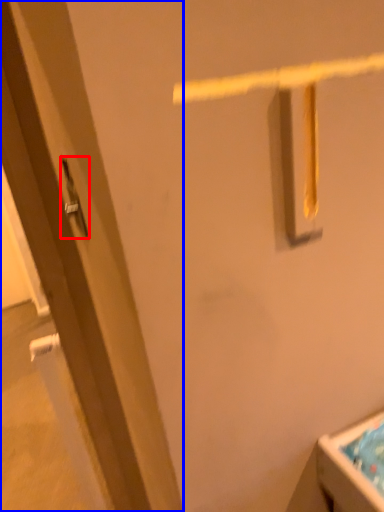
Question: Which of the following is the farthest to the observer, door handle (highlighted by a red box) or door (highlighted by a blue box)?

Choices:
 (A) door handle
 (B) door

Answer: (A)